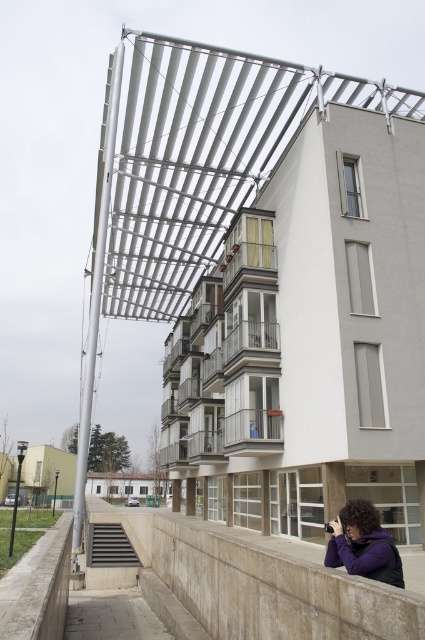
Who is more forward, (x=215, y=566) or (x=333, y=550)?

Point (x=333, y=550) is in front.

Who is lower down, concrete ledge at lower center or purple fleece jacket at lower center?

concrete ledge at lower center

Measure the distance between point (297, 637) and camera.

6.02 meters

Where is `concrete ledge at lower center`? concrete ledge at lower center is located at coordinates (257, 580).